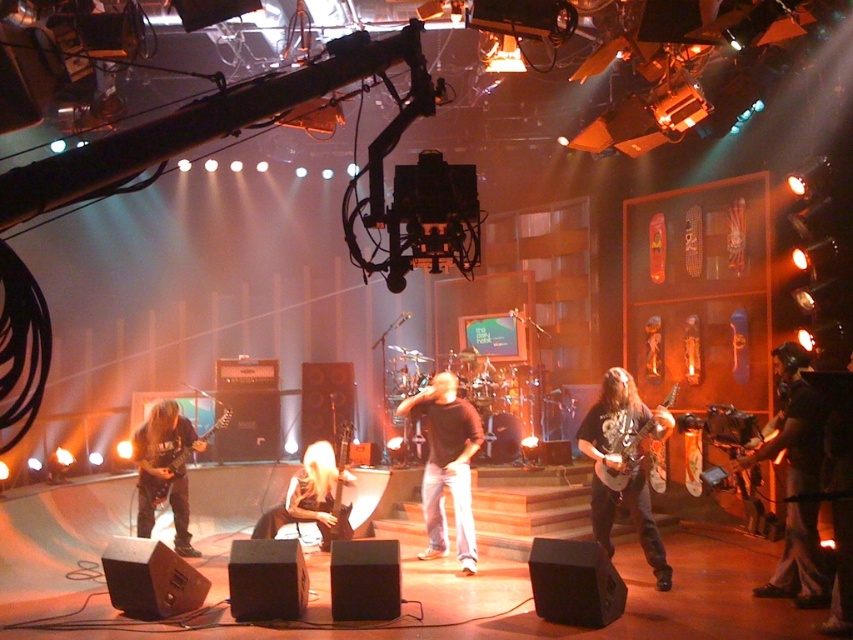
Question: Which of these objects is positioned farthest from the black leather jacket at left?

Choices:
 (A) shiny metallic guitar at center right
 (B) brown matte shirt at center
 (C) metallic silver guitar at center

Answer: (A)

Question: Is shiny metallic guitar at center right positioned in front of shiny black electric guitar at lower left?

Choices:
 (A) yes
 (B) no

Answer: (A)

Question: Is brown matte shirt at center to the left of shiny black electric guitar at lower left from the viewer's perspective?

Choices:
 (A) no
 (B) yes

Answer: (A)

Question: Which is nearer to the shiny metallic guitar at center right?

Choices:
 (A) shiny black electric guitar at lower left
 (B) shiny black guitar at center

Answer: (B)

Question: Is dark brown leather jacket at lower right wider than brown matte shirt at center?

Choices:
 (A) no
 (B) yes

Answer: (A)

Question: Considering the real-world distances, which object is farthest from the shiny black guitar at center?

Choices:
 (A) black leather jacket at left
 (B) shiny black electric guitar at lower left
 (C) dark brown leather jacket at lower right

Answer: (B)